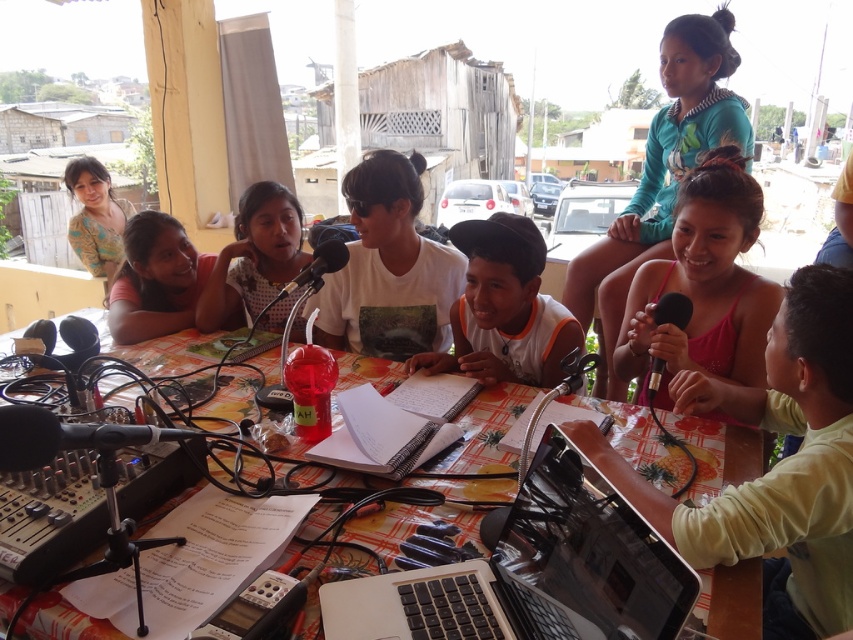
Question: Observing the image, what is the correct spatial positioning of matte black microphone at center in reference to black matte microphone at center?

Choices:
 (A) left
 (B) right

Answer: (A)

Question: Which object appears closest to the camera in this image?

Choices:
 (A) printed fabric shirt at upper left
 (B) white matte notebook at center
 (C) green fabric shirt at center

Answer: (C)

Question: Estimate the real-world distances between objects in this image. Which object is farther from the black metallic microphone at center?

Choices:
 (A) shiny silver laptop at center
 (B) black matte microphone at center
 (C) matte black microphone at center

Answer: (C)

Question: Is the position of orange printed tablecloth at center more distant than that of matte black microphone at center?

Choices:
 (A) yes
 (B) no

Answer: (B)

Question: Based on their relative distances, which object is farther from the printed fabric shirt at upper left?

Choices:
 (A) green fabric shirt at center
 (B) white matte notebook at center
 (C) matte white shirt at center
 (D) matte black microphone at center

Answer: (A)

Question: Is matte black microphone at center smaller than black matte microphone at center?

Choices:
 (A) yes
 (B) no

Answer: (B)